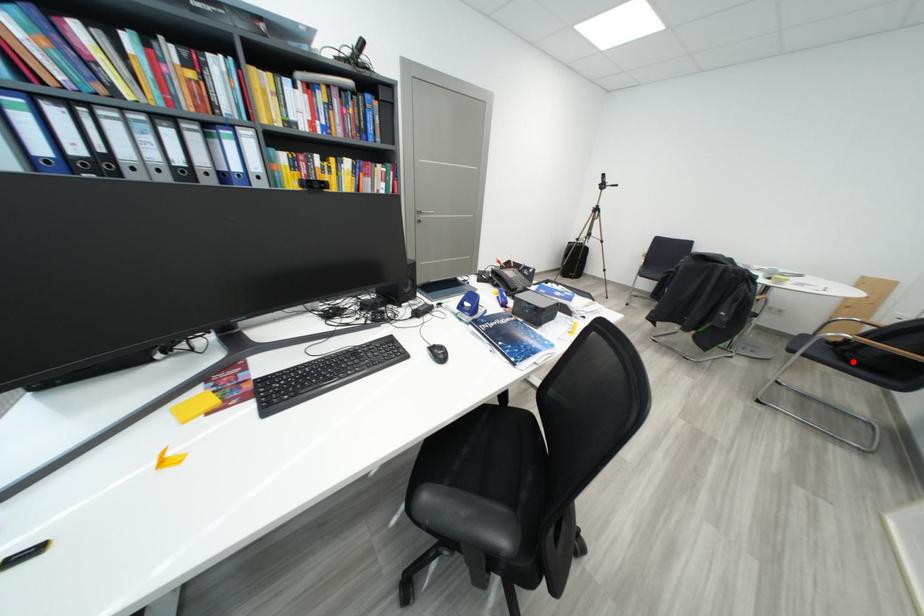
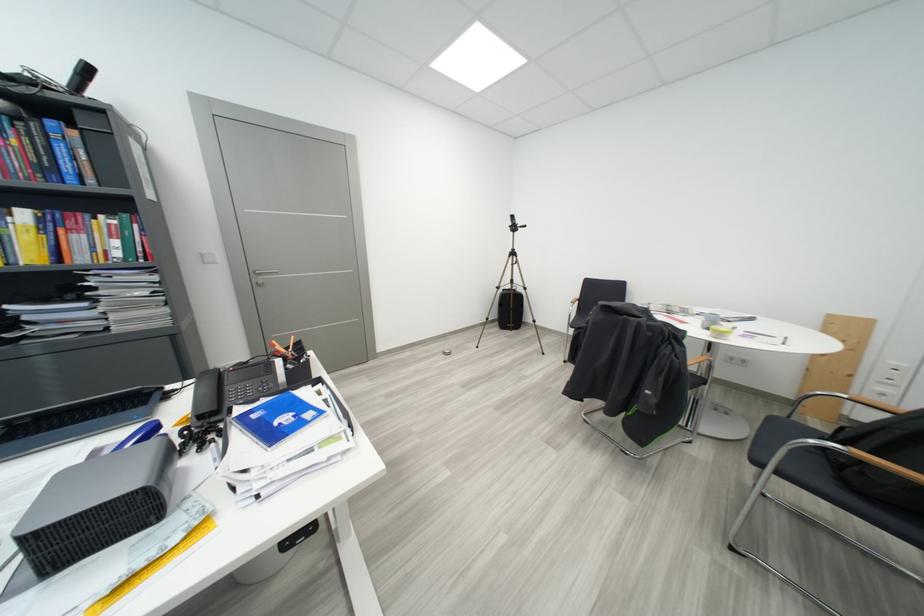
Locate, in the second image, the point that corresponds to the highlighted location in the first image.

(856, 487)